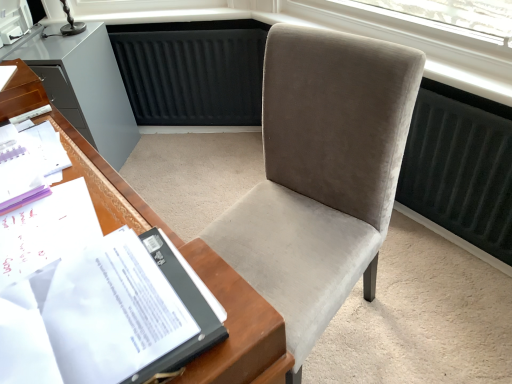
Question: Is velvet gray chair at center taller than white paper at left?

Choices:
 (A) no
 (B) yes

Answer: (B)

Question: Considering the relative sizes of velvet gray chair at center and white paper at left in the image provided, is velvet gray chair at center shorter than white paper at left?

Choices:
 (A) yes
 (B) no

Answer: (B)

Question: Can you confirm if velvet gray chair at center is bigger than white paper at left?

Choices:
 (A) yes
 (B) no

Answer: (A)

Question: From the image's perspective, is velvet gray chair at center beneath white paper at left?

Choices:
 (A) no
 (B) yes

Answer: (A)

Question: Is velvet gray chair at center turned away from white paper at left?

Choices:
 (A) yes
 (B) no

Answer: (B)

Question: Does point (286, 51) appear closer or farther from the camera than point (113, 299)?

Choices:
 (A) farther
 (B) closer

Answer: (A)

Question: Would you say velvet gray chair at center is to the left or to the right of white paper at left in the picture?

Choices:
 (A) left
 (B) right

Answer: (B)

Question: Considering their positions, is velvet gray chair at center located in front of or behind white paper at left?

Choices:
 (A) behind
 (B) front

Answer: (A)

Question: From a real-world perspective, is velvet gray chair at center physically located above or below white paper at left?

Choices:
 (A) above
 (B) below

Answer: (B)

Question: From a real-world perspective, relative to matte gray cabinet at left, is white paper at left vertically above or below?

Choices:
 (A) above
 (B) below

Answer: (A)

Question: From the image's perspective, is white paper at left located above or below matte gray cabinet at left?

Choices:
 (A) below
 (B) above

Answer: (A)

Question: Is white paper at left to the left or to the right of matte gray cabinet at left in the image?

Choices:
 (A) left
 (B) right

Answer: (B)

Question: Considering their positions, is white paper at left located in front of or behind matte gray cabinet at left?

Choices:
 (A) front
 (B) behind

Answer: (A)

Question: From a real-world perspective, is velvet gray chair at center positioned above or below white paper at left?

Choices:
 (A) below
 (B) above

Answer: (A)

Question: Is velvet gray chair at center wider or thinner than white paper at left?

Choices:
 (A) thin
 (B) wide

Answer: (B)